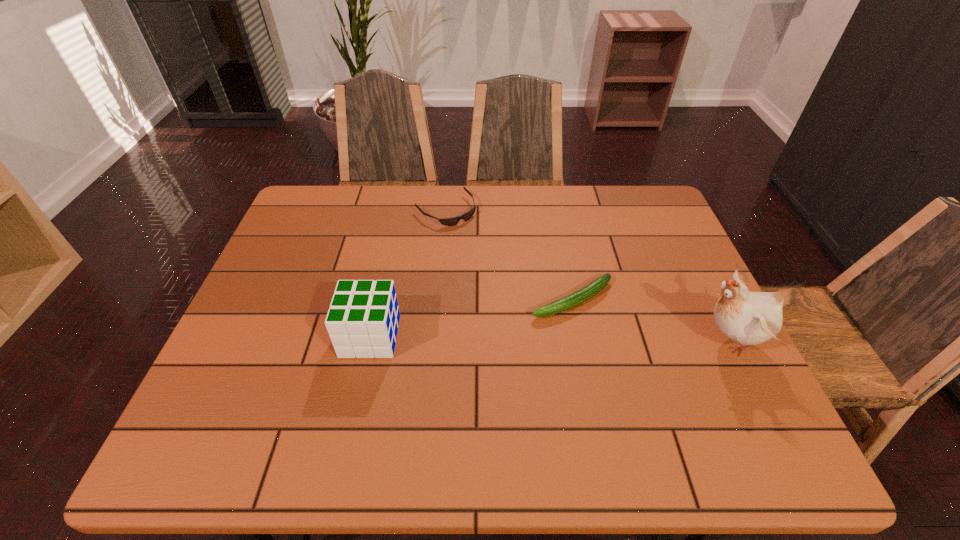
At what (x,y) coordinates should I click in order to perform the action: click on unoccupied area between the sunglasses and the rightmost object. Please return your answer as a coordinate pair (x, y). The width and height of the screenshot is (960, 540). Looking at the image, I should click on (588, 275).

Where is `free point between the third shortest object and the rightmost object`? free point between the third shortest object and the rightmost object is located at coordinates (550, 338).

I want to click on vacant space that's between the zucchini and the cube, so click(471, 318).

Identify the location of free space between the third shortest object and the farthest object. (408, 273).

Where is `free space between the shortest object and the cube`? This screenshot has height=540, width=960. free space between the shortest object and the cube is located at coordinates (408, 273).

Where is `vacant area that lies between the bird and the third object from left to right`? The width and height of the screenshot is (960, 540). vacant area that lies between the bird and the third object from left to right is located at coordinates (651, 319).

Find the location of a particular element. vacant area that lies between the second tallest object and the second object from right to left is located at coordinates (471, 318).

Where is `vacant point located between the zucchini and the second tallest object`? vacant point located between the zucchini and the second tallest object is located at coordinates (471, 318).

At what (x,y) coordinates should I click in order to perform the action: click on the closest object relative to the second tallest object. Please return your answer as a coordinate pair (x, y). This screenshot has width=960, height=540. Looking at the image, I should click on (593, 288).

At what (x,y) coordinates should I click in order to perform the action: click on object that ranks as the closest to the bird. Please return your answer as a coordinate pair (x, y). Looking at the image, I should click on (593, 288).